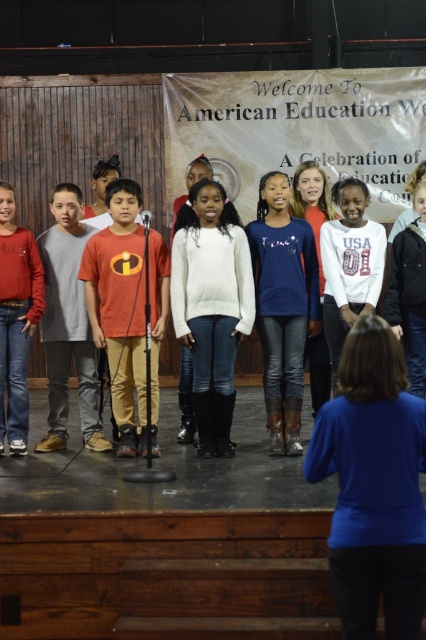
Question: Does white sweater at center appear over orange cotton shirt at center?

Choices:
 (A) no
 (B) yes

Answer: (A)

Question: Does blue denim jeans at center lie behind white matte sweater at center?

Choices:
 (A) yes
 (B) no

Answer: (A)

Question: Which point is farther to the camera?

Choices:
 (A) (77, 208)
 (B) (396, 317)
 (C) (28, 237)

Answer: (C)

Question: Which is nearer to the white matte sweater at center?

Choices:
 (A) matte red sweater at left
 (B) matte orange shirt at center
 (C) orange cotton shirt at center
 (D) blue denim jeans at center

Answer: (D)

Question: Among these points, which one is nearest to the camera?

Choices:
 (A) (98, 381)
 (B) (218, 259)
 (C) (278, 216)

Answer: (B)

Question: Can you confirm if white sweater at center is positioned to the right of orange cotton shirt at center?

Choices:
 (A) no
 (B) yes

Answer: (B)